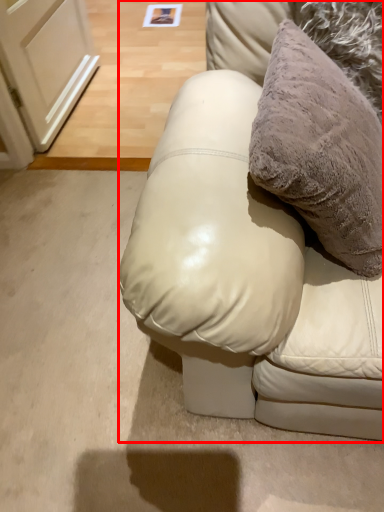
Question: From the image's perspective, considering the relative positions of furniture (annotated by the red box) and pillow in the image provided, where is furniture (annotated by the red box) located with respect to the staircase?

Choices:
 (A) below
 (B) above

Answer: (A)